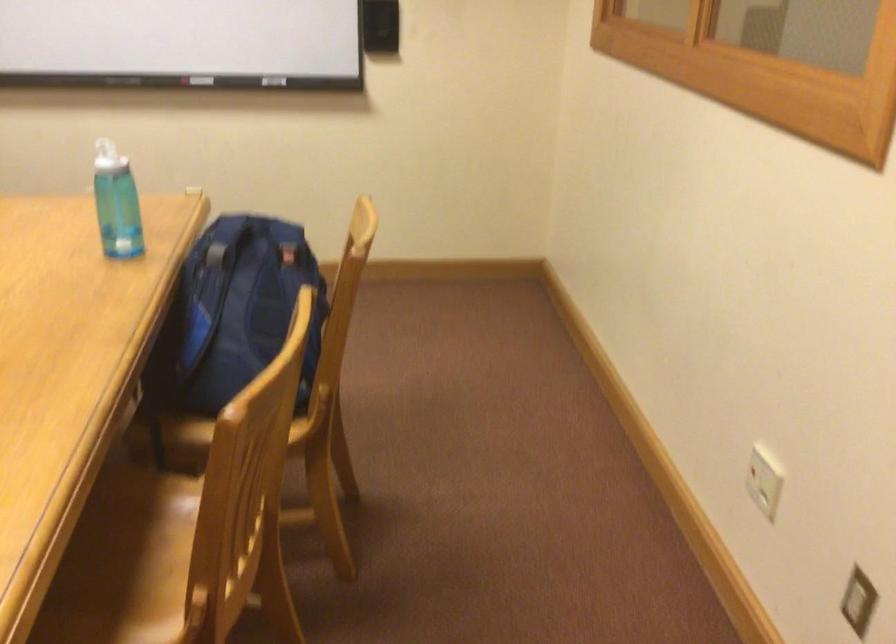
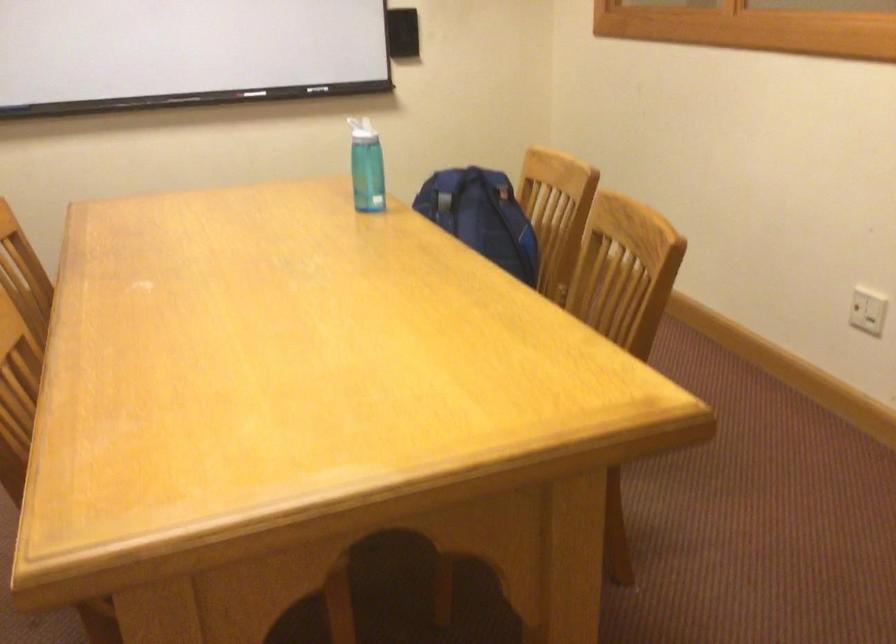
Locate, in the second image, the point that corresponds to point 282,278 in the first image.

(481, 216)